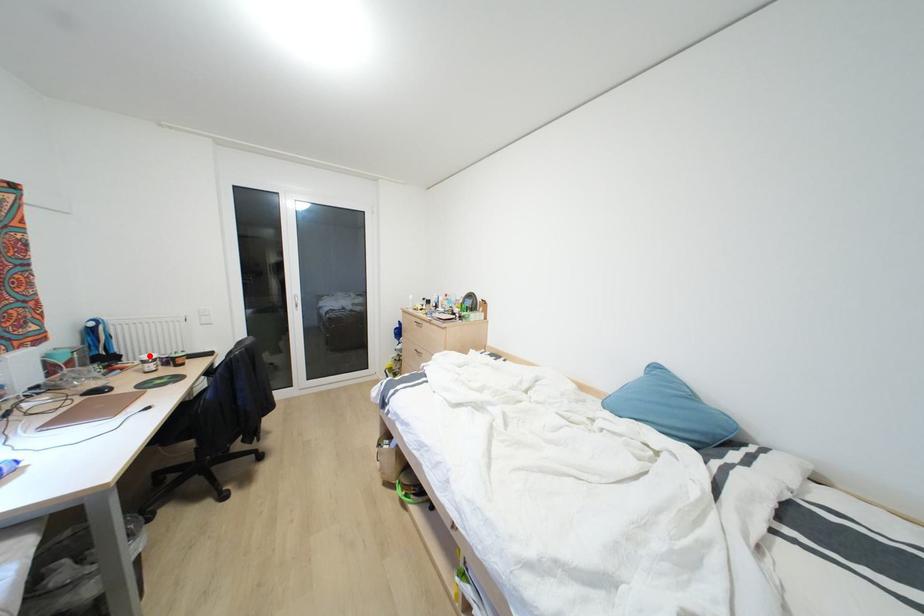
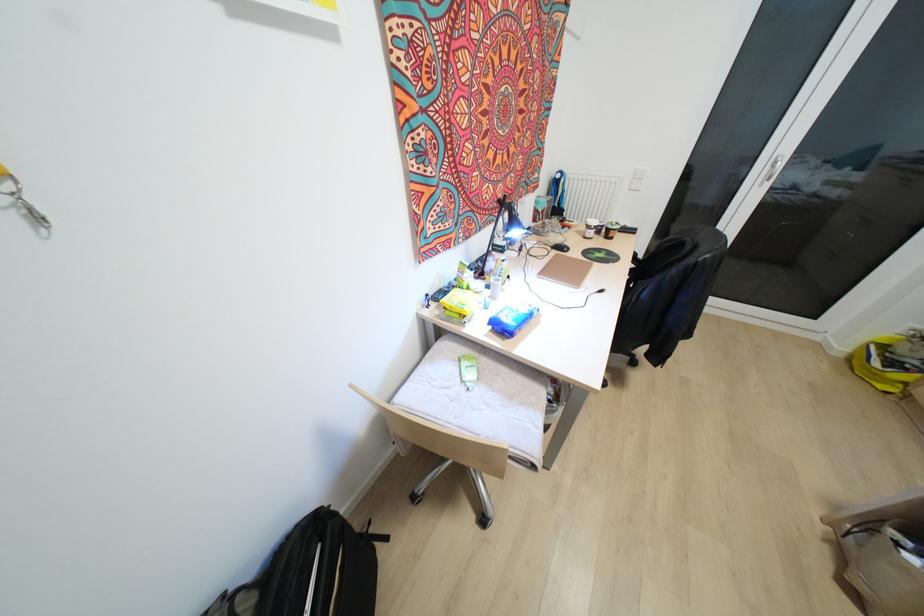
In the second image, find the point that corresponds to the highlighted location in the first image.

(592, 222)